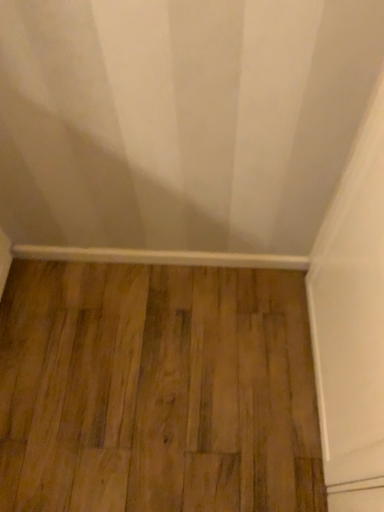
Question: Considering the relative positions of brown wood flooring at center and white smooth baseboard at bottom in the image provided, is brown wood flooring at center to the left or to the right of white smooth baseboard at bottom?

Choices:
 (A) right
 (B) left

Answer: (A)

Question: From a real-world perspective, is brown wood flooring at center above or below white smooth baseboard at bottom?

Choices:
 (A) below
 (B) above

Answer: (A)

Question: Considering the positions of point (221, 329) and point (24, 253), is point (221, 329) closer or farther from the camera than point (24, 253)?

Choices:
 (A) closer
 (B) farther

Answer: (A)

Question: In terms of size, does white smooth baseboard at bottom appear bigger or smaller than brown wood flooring at center?

Choices:
 (A) big
 (B) small

Answer: (B)

Question: Looking at their shapes, would you say white smooth baseboard at bottom is wider or thinner than brown wood flooring at center?

Choices:
 (A) thin
 (B) wide

Answer: (A)

Question: From the image's perspective, is white smooth baseboard at bottom positioned above or below brown wood flooring at center?

Choices:
 (A) above
 (B) below

Answer: (A)

Question: Does point (92, 254) appear closer or farther from the camera than point (26, 413)?

Choices:
 (A) farther
 (B) closer

Answer: (A)